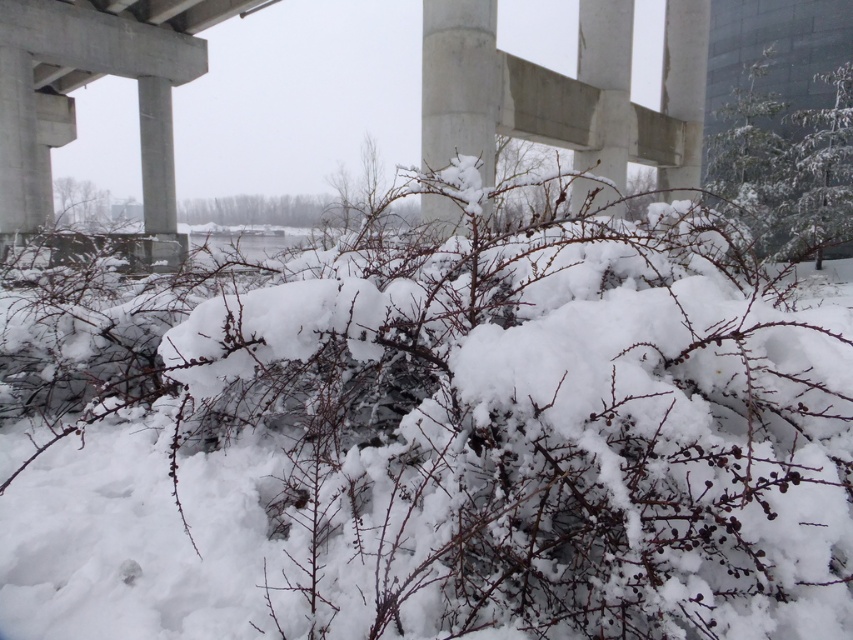
Is white fluffy snow at center thinner than concrete at center?

Indeed, white fluffy snow at center has a lesser width compared to concrete at center.

Which of these two, white fluffy snow at center or concrete at center, stands shorter?

With less height is white fluffy snow at center.

Is point (390, 358) in front of point (579, 97)?

Yes, it is.

The width and height of the screenshot is (853, 640). I want to click on white fluffy snow at center, so click(x=442, y=448).

Can you confirm if white fluffy snow at center is shorter than snow-covered concrete pillar at center?

Yes, white fluffy snow at center is shorter than snow-covered concrete pillar at center.

Is point (438, 273) positioned behind point (485, 166)?

That is False.

The image size is (853, 640). What do you see at coordinates (442, 448) in the screenshot?
I see `white fluffy snow at center` at bounding box center [442, 448].

Identify the location of white fluffy snow at center. This screenshot has height=640, width=853. (442, 448).

Which of these two, concrete at center or snow-covered concrete pillar at center, stands shorter?

With less height is snow-covered concrete pillar at center.

Does concrete at center appear on the right side of snow-covered concrete pillar at center?

In fact, concrete at center is to the left of snow-covered concrete pillar at center.

The width and height of the screenshot is (853, 640). I want to click on concrete at center, so click(x=564, y=92).